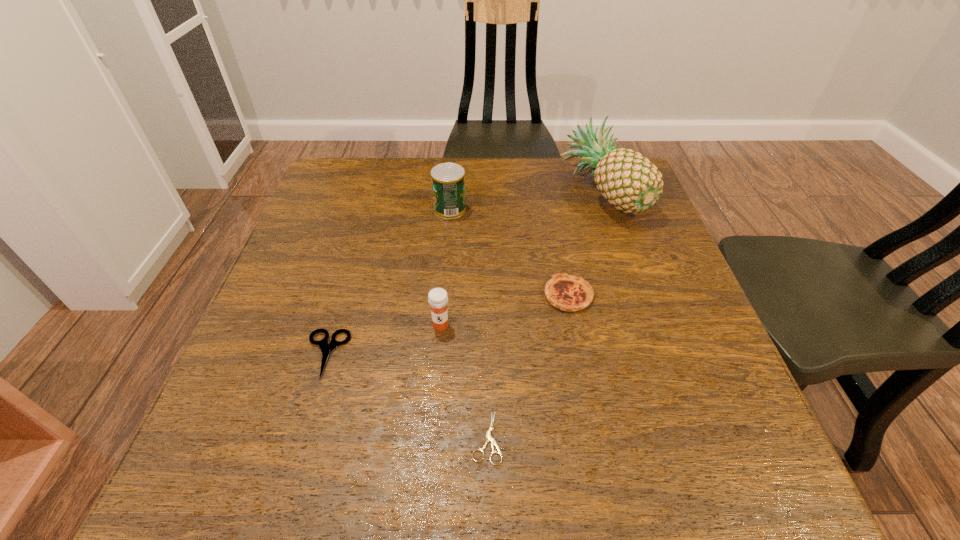
This screenshot has height=540, width=960. Find the location of `free space that satisfies the following two spatial constraints: 1. on the label side of the nearest object; 2. on the left side of the third tallest object`. free space that satisfies the following two spatial constraints: 1. on the label side of the nearest object; 2. on the left side of the third tallest object is located at coordinates (432, 437).

At what (x,y) coordinates should I click in order to perform the action: click on free space that satisfies the following two spatial constraints: 1. on the back side of the tallest object; 2. on the right side of the shortest object. Please return your answer as a coordinate pair (x, y). This screenshot has height=540, width=960. Looking at the image, I should click on (484, 192).

Locate an element on the screen. Image resolution: width=960 pixels, height=540 pixels. vacant area in the image that satisfies the following two spatial constraints: 1. on the label side of the right shears; 2. on the right side of the medicine is located at coordinates (432, 437).

Identify the location of free spot that satisfies the following two spatial constraints: 1. on the back side of the right shears; 2. on the left side of the third farthest object. This screenshot has width=960, height=540. (485, 295).